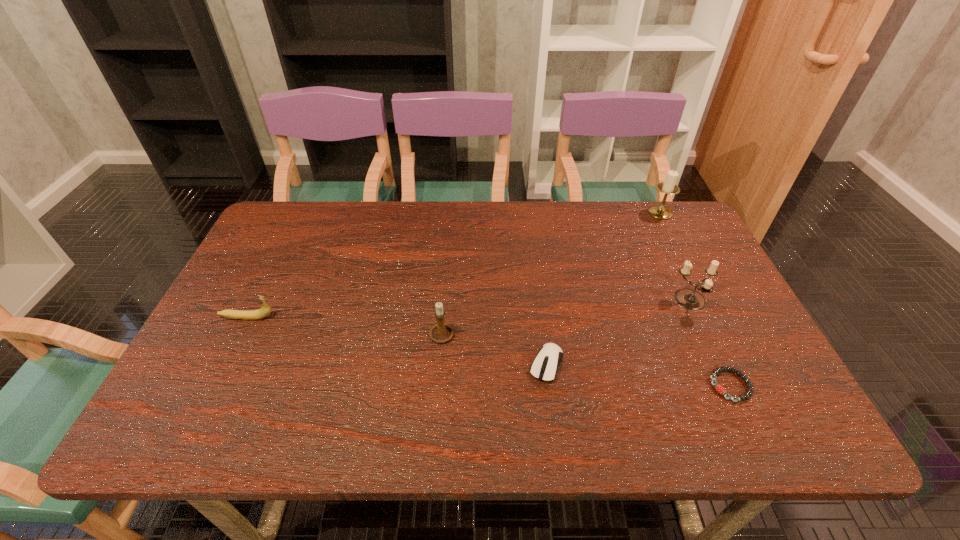
Find the location of a particular element. The width and height of the screenshot is (960, 540). the farthest object is located at coordinates (668, 187).

The height and width of the screenshot is (540, 960). What are the coordinates of `the tallest object` in the screenshot? It's located at (668, 187).

Locate an element on the screen. the second nearest candle holder is located at coordinates (689, 299).

You are a GUI agent. You are given a task and a screenshot of the screen. Output one action in this format:
    pyautogui.click(x=<x>, y=<y>)
    Task: Click on the second object from left to right
    The image size is (960, 540).
    Given the screenshot: What is the action you would take?
    pyautogui.click(x=440, y=332)

Where is `the nearest candle holder`? the nearest candle holder is located at coordinates (440, 332).

The image size is (960, 540). In order to click on the leftmost object in this screenshot , I will do `click(263, 312)`.

This screenshot has height=540, width=960. In order to click on the third shortest object in this screenshot , I will do `click(263, 312)`.

Identify the location of the fifth tallest object. The height and width of the screenshot is (540, 960). (544, 367).

Where is `mouse`? mouse is located at coordinates (544, 367).

The width and height of the screenshot is (960, 540). Find the location of `bracelet`. bracelet is located at coordinates coord(719,388).